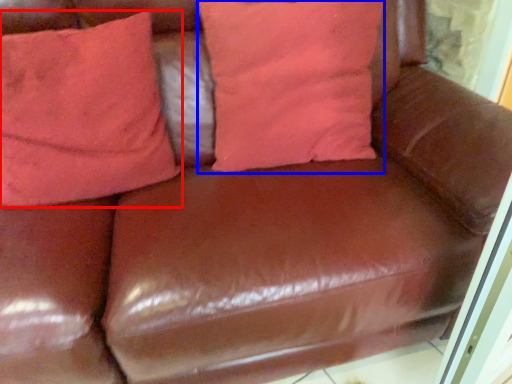
Question: Among these objects, which one is farthest to the camera, pillow (highlighted by a red box) or pillow (highlighted by a blue box)?

Choices:
 (A) pillow
 (B) pillow

Answer: (B)